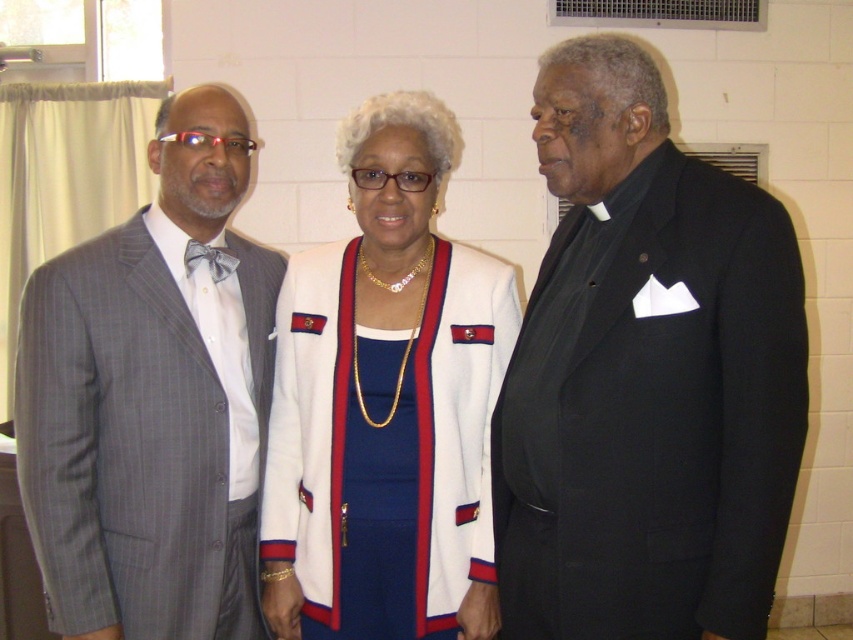
You are a photographer at a formal event. You need to adjust the camera focus so that both the black satin suit at right and the white fabric jacket at center are in focus. Considering their heights, which one should you focus on first to ensure both are sharp?

The black satin suit at right is much taller than the white fabric jacket at center. To ensure both are in focus, you should focus on the black satin suit at right first, as it is taller and likely farther away, requiring a greater depth of field.

You are standing in the room where the three people are. You want to hand a document to the person in the gray pinstripe suit at left but need to walk past the black satin suit at right. Is there enough space between them to walk through?

The black satin suit at right is closer to the viewer than gray pinstripe suit at left, so there is space between them to walk through.